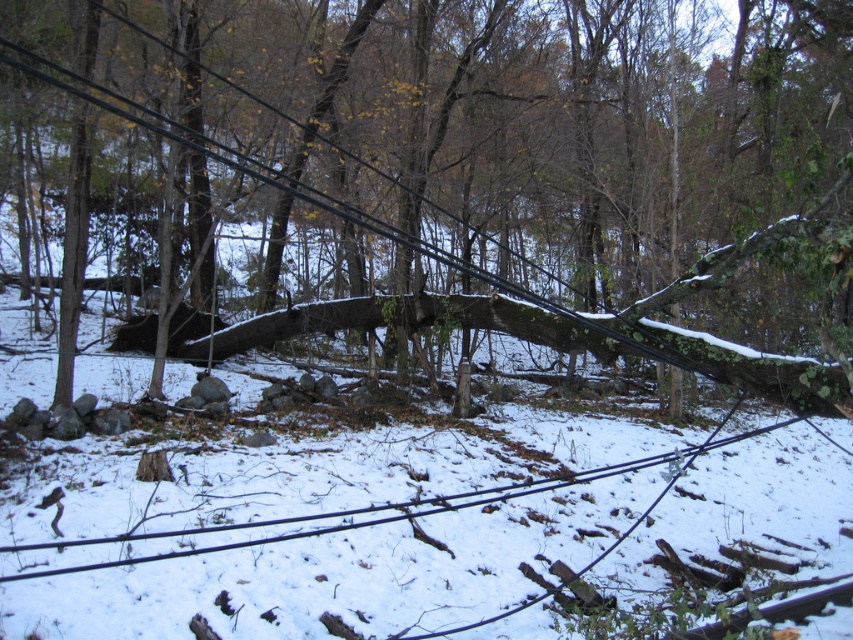
Question: Is brown rough tree trunk at center to the left of black wire at lower center from the viewer's perspective?

Choices:
 (A) yes
 (B) no

Answer: (A)

Question: Among these points, which one is nearest to the camera?

Choices:
 (A) (624, 145)
 (B) (465, 502)

Answer: (B)

Question: Which point is closer to the camera?

Choices:
 (A) (653, 144)
 (B) (177, 552)

Answer: (B)

Question: Which point is closer to the camera?

Choices:
 (A) (196, 531)
 (B) (646, 333)

Answer: (B)

Question: Is brown rough tree trunk at center smaller than black wire at lower center?

Choices:
 (A) yes
 (B) no

Answer: (B)

Question: Does brown rough tree trunk at center appear on the right side of black wire at lower center?

Choices:
 (A) no
 (B) yes

Answer: (A)